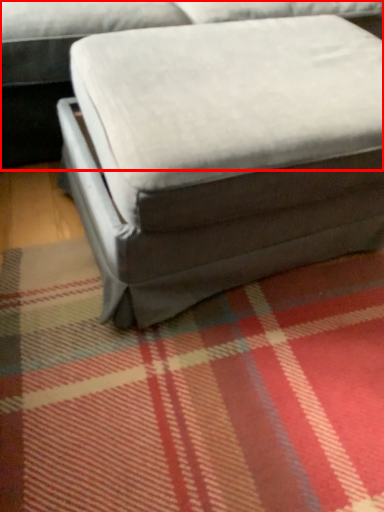
Question: Considering the relative positions of studio couch (annotated by the red box) and bean bag chair in the image provided, where is studio couch (annotated by the red box) located with respect to the staircase?

Choices:
 (A) left
 (B) right

Answer: (A)